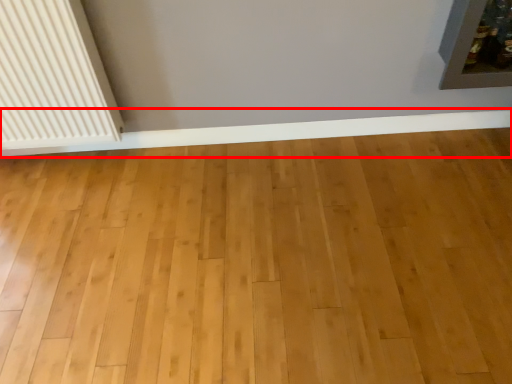
Question: Where is ledge (annotated by the red box) located in relation to radiator in the image?

Choices:
 (A) right
 (B) left

Answer: (A)